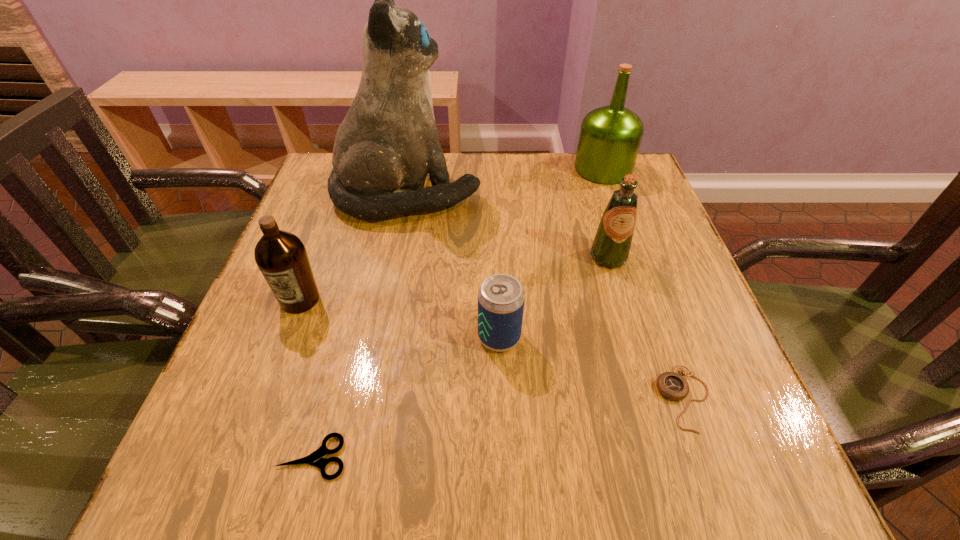
Where is `blank region between the third nearest object and the tallest olive oil`? This screenshot has height=540, width=960. blank region between the third nearest object and the tallest olive oil is located at coordinates (551, 253).

Where is `vacant space that's between the leftmost olive oil and the tallest object`? vacant space that's between the leftmost olive oil and the tallest object is located at coordinates (353, 247).

Where is `free spot between the third shortest object and the fifth nearest object`? free spot between the third shortest object and the fifth nearest object is located at coordinates (554, 297).

Image resolution: width=960 pixels, height=540 pixels. What are the coordinates of `free space between the cat and the second nearest olive oil` in the screenshot? It's located at (508, 225).

Locate an element on the screen. This screenshot has width=960, height=540. vacant area that lies between the nearest object and the tallest olive oil is located at coordinates (458, 313).

Where is `vacant area that lies between the farthest olive oil and the cat`? Image resolution: width=960 pixels, height=540 pixels. vacant area that lies between the farthest olive oil and the cat is located at coordinates (505, 181).

Locate an element on the screen. The image size is (960, 540). vacant region between the leftmost olive oil and the tallest olive oil is located at coordinates (451, 234).

At what (x,y) coordinates should I click in order to perform the action: click on object that is the sixth closest one to the sixth shortest object. Please return your answer as a coordinate pair (x, y). This screenshot has height=540, width=960. Looking at the image, I should click on (315, 459).

Identify which object is located as the fifth nearest to the cat. Please provide its 2D coordinates. Your answer should be formatted as a tuple, i.e. [(x, y)], where the tuple contains the x and y coordinates of a point satisfying the conditions above.

[(673, 386)]

Locate an element on the screen. The height and width of the screenshot is (540, 960). olive oil that is the third closest one to the second nearest object is located at coordinates (281, 256).